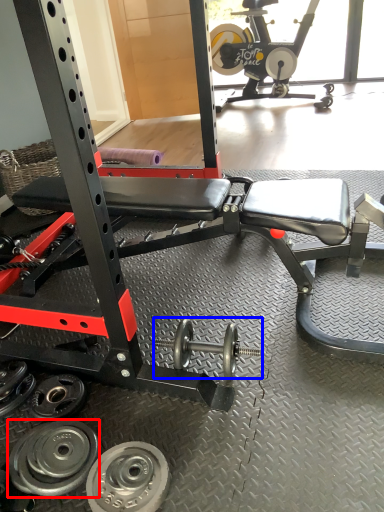
Question: Among these objects, which one is nearest to the camera, wheel (highlighted by a red box) or dumbbell (highlighted by a blue box)?

Choices:
 (A) wheel
 (B) dumbbell

Answer: (A)